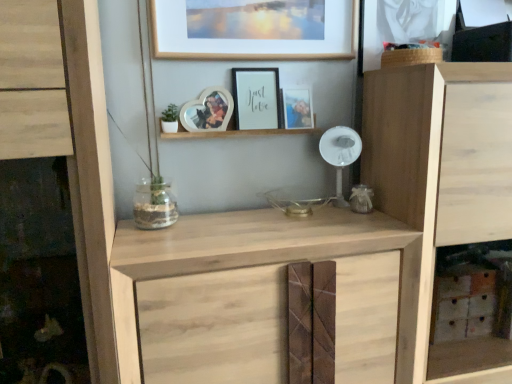
This screenshot has height=384, width=512. I want to click on vacant area located to the right-hand side of clear glass jar at center, so click(x=206, y=217).